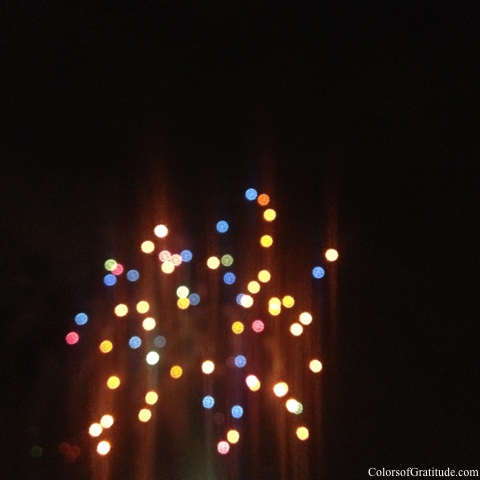
Where is `right most blue light`? The image size is (480, 480). right most blue light is located at coordinates [x=318, y=272].